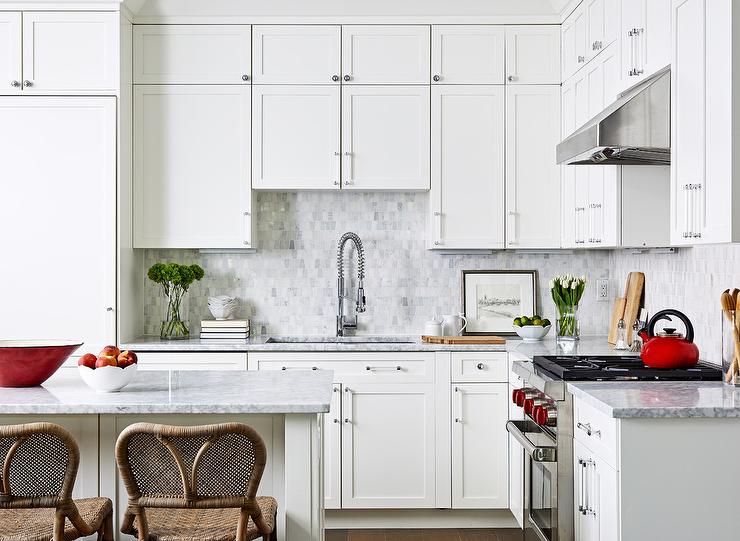
Locate an element on the screen. cutting board is located at coordinates (635, 296), (619, 302).